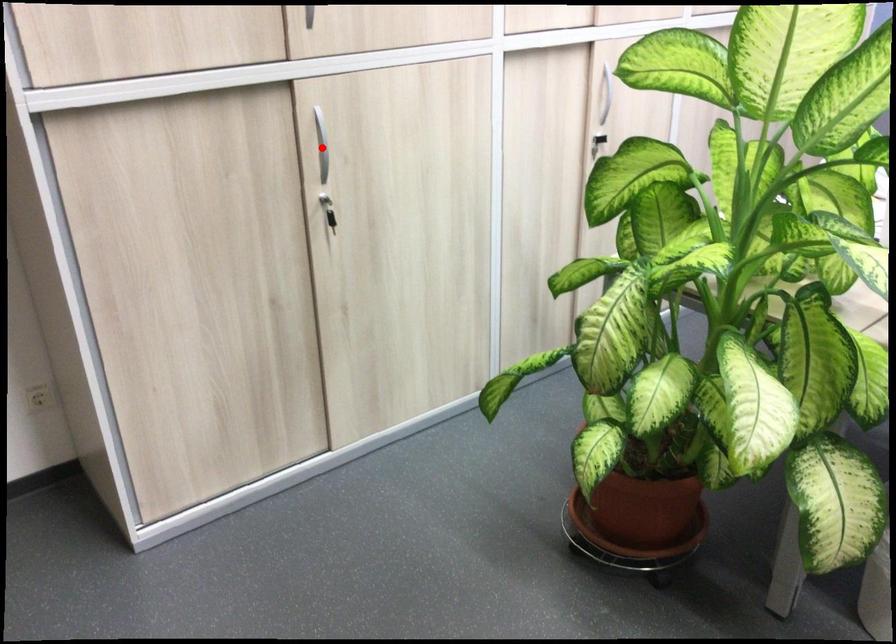
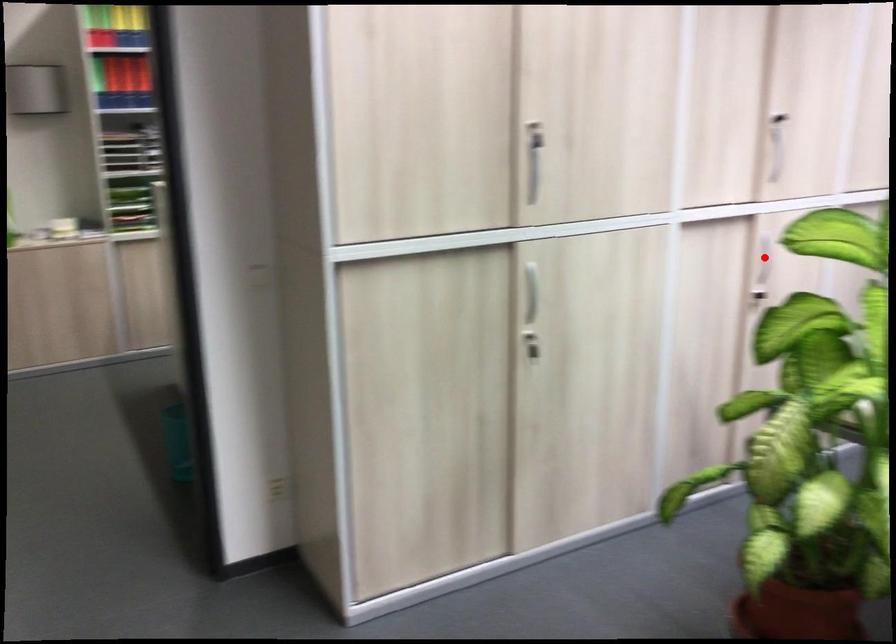
I am providing you with two images of the same scene from different viewpoints. A red point is marked on the first image and another point is marked on the second image. Does the point marked in image1 correspond to the same location as the one in image2?

No